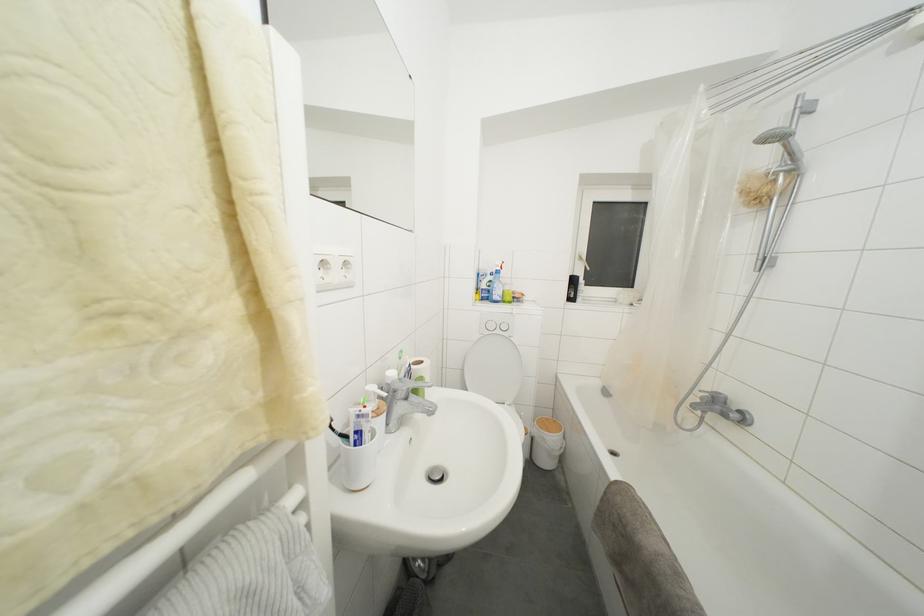
The height and width of the screenshot is (616, 924). Identify the location of beige bath sponge. (640, 556).